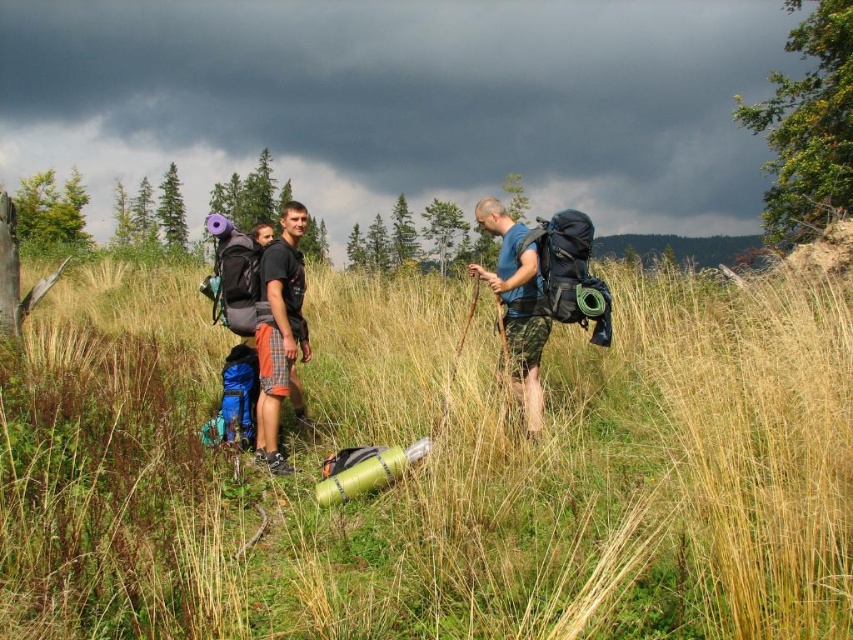
Question: Is green grassy at center to the right of matte black t-shirt at center from the viewer's perspective?

Choices:
 (A) yes
 (B) no

Answer: (A)

Question: Estimate the real-world distances between objects in this image. Which object is closer to the blue fabric backpack at center?

Choices:
 (A) matte black t-shirt at center
 (B) green grassy at center

Answer: (A)

Question: Is green grassy at center smaller than blue fabric backpack at center?

Choices:
 (A) yes
 (B) no

Answer: (B)

Question: Among these objects, which one is farthest from the camera?

Choices:
 (A) green grassy at center
 (B) matte black t-shirt at center

Answer: (B)

Question: Does matte black t-shirt at center appear on the right side of blue fabric backpack at center?

Choices:
 (A) yes
 (B) no

Answer: (B)

Question: Which of the following is the farthest from the observer?

Choices:
 (A) blue fabric backpack at center
 (B) green grassy at center

Answer: (A)